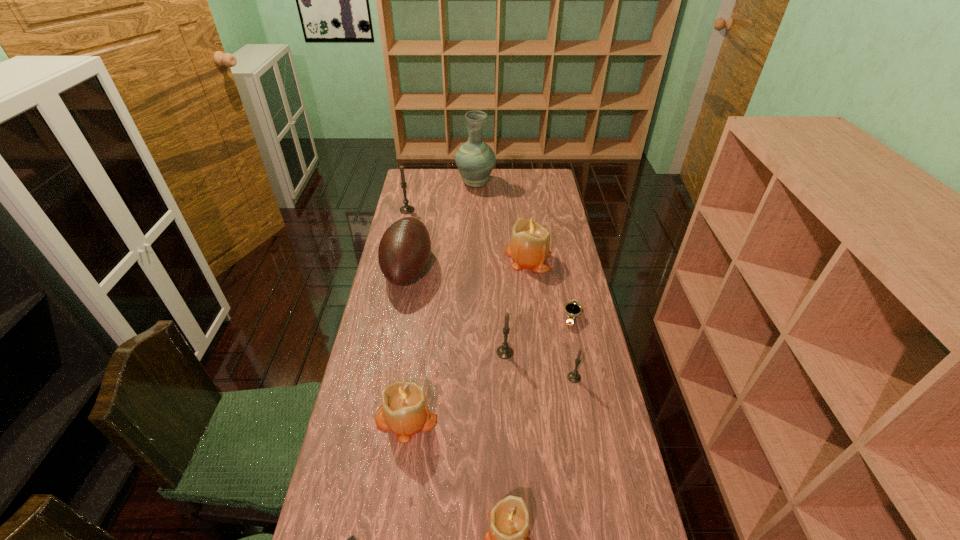
At what (x,y) coordinates should I click in order to perform the action: click on free space between the brown football (American) and the second shortest object. Please return your answer as a coordinate pair (x, y). This screenshot has width=960, height=540. Looking at the image, I should click on (490, 293).

Image resolution: width=960 pixels, height=540 pixels. I want to click on free space between the fourth nearest candle and the farthest gray candle, so 456,281.

Locate an element on the screen. The width and height of the screenshot is (960, 540). vacant point located between the eighth farthest object and the leftmost candle is located at coordinates (406, 314).

At what (x,y) coordinates should I click in order to perform the action: click on empty location between the second candle from left to right and the brown football (American). Please return your answer as a coordinate pair (x, y). Looking at the image, I should click on pyautogui.click(x=407, y=343).

Where is `free space between the tallest object and the farthest beige candle`? This screenshot has height=540, width=960. free space between the tallest object and the farthest beige candle is located at coordinates (502, 220).

Where is `free space between the ninth tallest object and the second smallest beige candle`? The width and height of the screenshot is (960, 540). free space between the ninth tallest object and the second smallest beige candle is located at coordinates (489, 367).

Point out which object is positioned as the ninth nearest to the remote control. Please provide its 2D coordinates. Your answer should be formatted as a tuple, i.e. [(x, y)], where the tuple contains the x and y coordinates of a point satisfying the conditions above.

[(475, 160)]

Point out which object is positioned as the eighth nearest to the football (American). Please provide its 2D coordinates. Your answer should be formatted as a tuple, i.e. [(x, y)], where the tuple contains the x and y coordinates of a point satisfying the conditions above.

[(507, 539)]

The image size is (960, 540). Identify the location of candle object that ranks as the fourth closest to the brown football (American). (404, 410).

What are the coordinates of `candle object that ranks as the closest to the brown football (American)` in the screenshot? It's located at (406, 209).